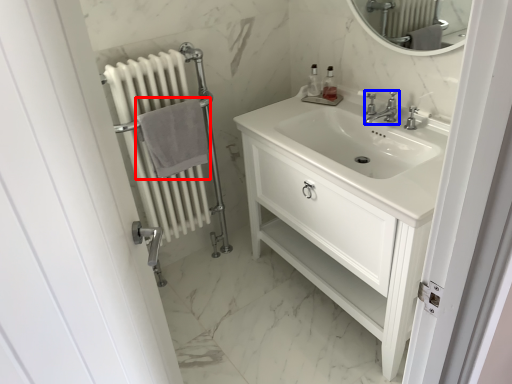
Question: Which object appears farthest to the camera in this image, bath towel (highlighted by a red box) or tap (highlighted by a blue box)?

Choices:
 (A) bath towel
 (B) tap

Answer: (A)